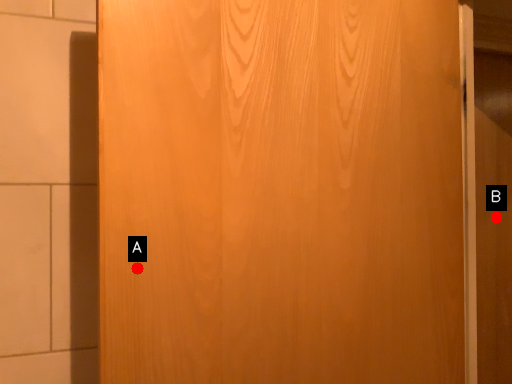
Question: Two points are circled on the image, labeled by A and B beside each circle. Among these points, which one is nearest to the camera?

Choices:
 (A) A is closer
 (B) B is closer

Answer: (A)